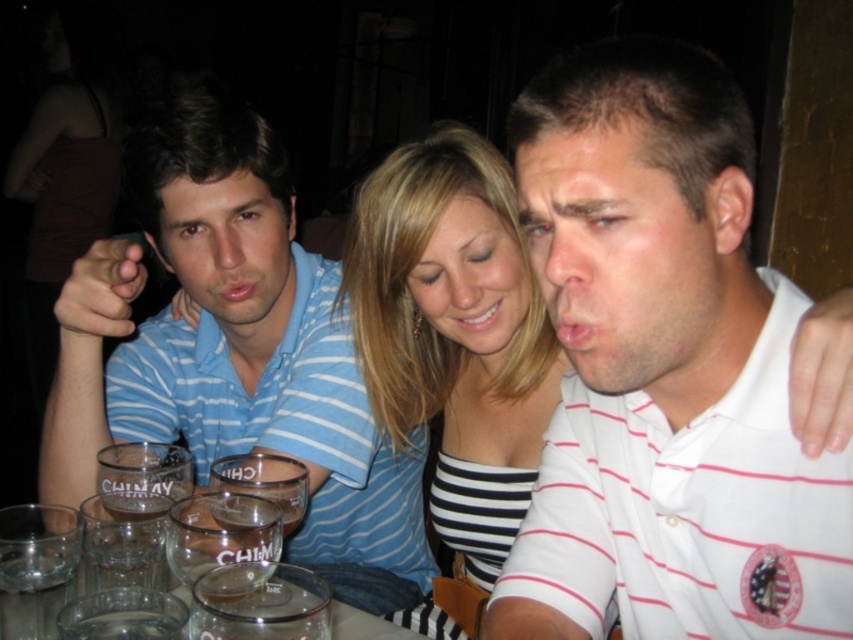
Does blue striped polo shirt at left have a lesser height compared to transparent glass at lower left?

No, blue striped polo shirt at left is not shorter than transparent glass at lower left.

Who is shorter, blue striped polo shirt at left or transparent glass at lower left?

Standing shorter between the two is transparent glass at lower left.

What do you see at coordinates (231, 346) in the screenshot? I see `blue striped polo shirt at left` at bounding box center [231, 346].

Find the location of `blue striped polo shirt at left`. blue striped polo shirt at left is located at coordinates (231, 346).

Describe the element at coordinates (36, 566) in the screenshot. I see `transparent glass at lower left` at that location.

Does point (49, 563) come behind point (192, 525)?

No, it is in front of (192, 525).

Is point (7, 605) closer to camera compared to point (263, 515)?

Yes.

This screenshot has height=640, width=853. I want to click on transparent glass at lower left, so click(36, 566).

Is the position of white striped polo shirt at right more distant than that of clear glass shot glass at lower center?

No, white striped polo shirt at right is closer to the viewer.

Between white striped polo shirt at right and clear glass shot glass at lower center, which one appears on the right side from the viewer's perspective?

white striped polo shirt at right is more to the right.

Describe the element at coordinates (663, 369) in the screenshot. I see `white striped polo shirt at right` at that location.

The width and height of the screenshot is (853, 640). Identify the location of white striped polo shirt at right. (663, 369).